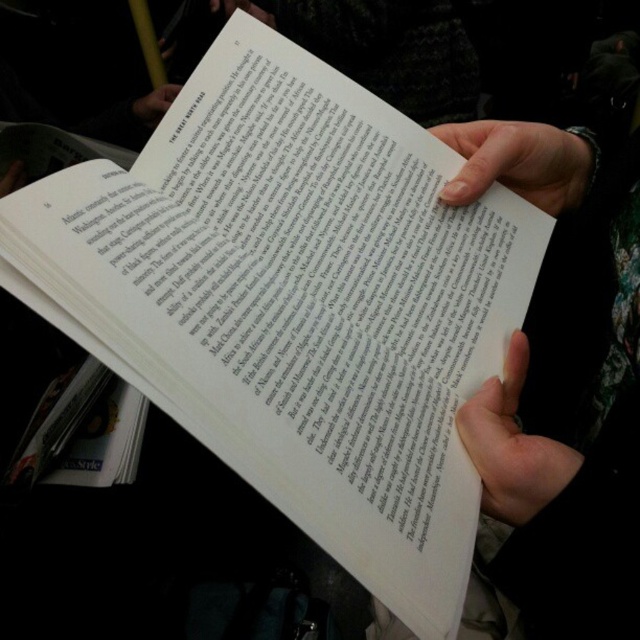
Question: Observing the image, what is the correct spatial positioning of white paper at center in reference to white paper book at lower left?

Choices:
 (A) below
 (B) above

Answer: (B)

Question: Which object appears closest to the camera in this image?

Choices:
 (A) smooth skin hand at lower right
 (B) smooth skin hand at upper right
 (C) matte white paper at upper center

Answer: (A)

Question: Which point appears farthest from the camera in this image?

Choices:
 (A) (620, 184)
 (B) (525, 198)

Answer: (B)

Question: Which object is farther from the camera taking this photo?

Choices:
 (A) white paper at upper center
 (B) matte white paper at upper center

Answer: (B)

Question: Is white paper book at lower left to the right of matte white paper at upper center from the viewer's perspective?

Choices:
 (A) no
 (B) yes

Answer: (B)

Question: Observing the image, what is the correct spatial positioning of smooth skin hand at lower right in reference to smooth skin hand at upper right?

Choices:
 (A) right
 (B) left

Answer: (B)